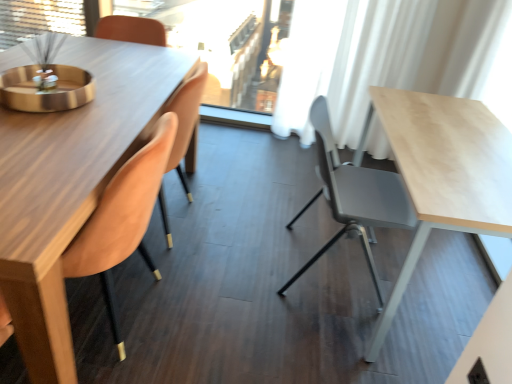
Question: Is the depth of velvet orange chair at left, which appears as the 1th chair when viewed from the left, less than that of white sheer curtain at upper center?

Choices:
 (A) no
 (B) yes

Answer: (B)

Question: Is velvet orange chair at left, which appears as the 1th chair when viewed from the left, thinner than white sheer curtain at upper center?

Choices:
 (A) yes
 (B) no

Answer: (B)

Question: Is velvet orange chair at left, the 2th chair when ordered from right to left, oriented away from white sheer curtain at upper center?

Choices:
 (A) no
 (B) yes

Answer: (A)

Question: Is velvet orange chair at left, the 2th chair when ordered from right to left, outside white sheer curtain at upper center?

Choices:
 (A) no
 (B) yes

Answer: (B)

Question: Can you confirm if velvet orange chair at left, which appears as the 1th chair when viewed from the left, is wider than white sheer curtain at upper center?

Choices:
 (A) yes
 (B) no

Answer: (A)

Question: Based on their positions, is white sheer curtain at upper center located to the left or right of matte gray chair at center, which is the 1th chair from right to left?

Choices:
 (A) left
 (B) right

Answer: (A)

Question: From a real-world perspective, is white sheer curtain at upper center positioned above or below matte gray chair at center, which is the 1th chair from right to left?

Choices:
 (A) above
 (B) below

Answer: (A)

Question: Considering the positions of point (225, 69) and point (367, 190), is point (225, 69) closer or farther from the camera than point (367, 190)?

Choices:
 (A) farther
 (B) closer

Answer: (A)

Question: From their relative heights in the image, would you say white sheer curtain at upper center is taller or shorter than matte gray chair at center, which is the 1th chair from right to left?

Choices:
 (A) tall
 (B) short

Answer: (A)

Question: Looking at their shapes, would you say velvet orange chair at left, which appears as the 1th chair when viewed from the left, is wider or thinner than white sheer curtain at upper center?

Choices:
 (A) thin
 (B) wide

Answer: (B)

Question: Is velvet orange chair at left, the 2th chair when ordered from right to left, in front of or behind white sheer curtain at upper center in the image?

Choices:
 (A) front
 (B) behind

Answer: (A)

Question: From their relative heights in the image, would you say velvet orange chair at left, the 2th chair when ordered from right to left, is taller or shorter than white sheer curtain at upper center?

Choices:
 (A) short
 (B) tall

Answer: (A)

Question: Does point (141, 193) appear closer or farther from the camera than point (266, 18)?

Choices:
 (A) closer
 (B) farther

Answer: (A)

Question: Relative to velvet orange chair at left, which appears as the 1th chair when viewed from the left, is matte gray chair at center, which is the 1th chair from right to left, in front or behind?

Choices:
 (A) front
 (B) behind

Answer: (B)

Question: Visually, is matte gray chair at center, the 2th chair positioned from the left, positioned to the left or to the right of velvet orange chair at left, the 2th chair when ordered from right to left?

Choices:
 (A) left
 (B) right

Answer: (B)